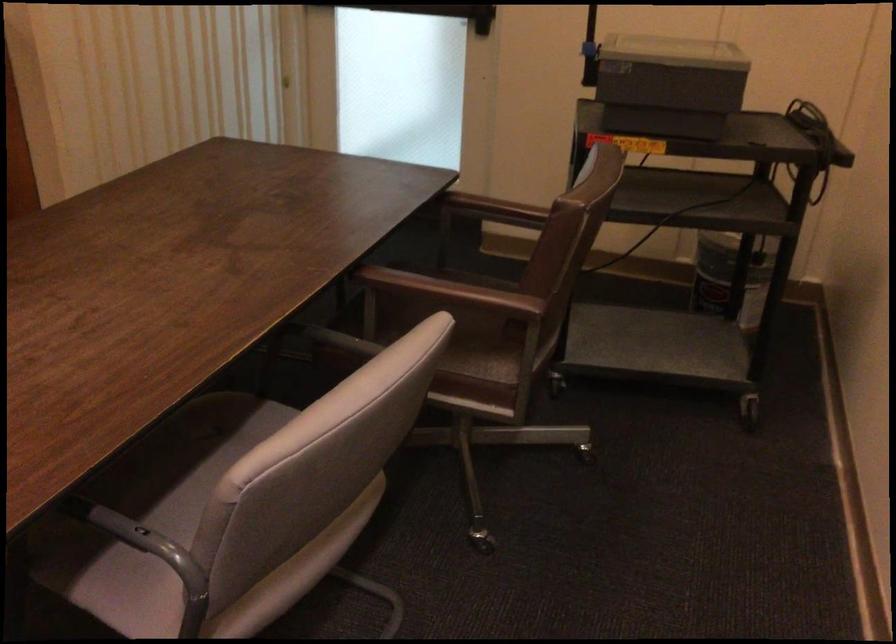
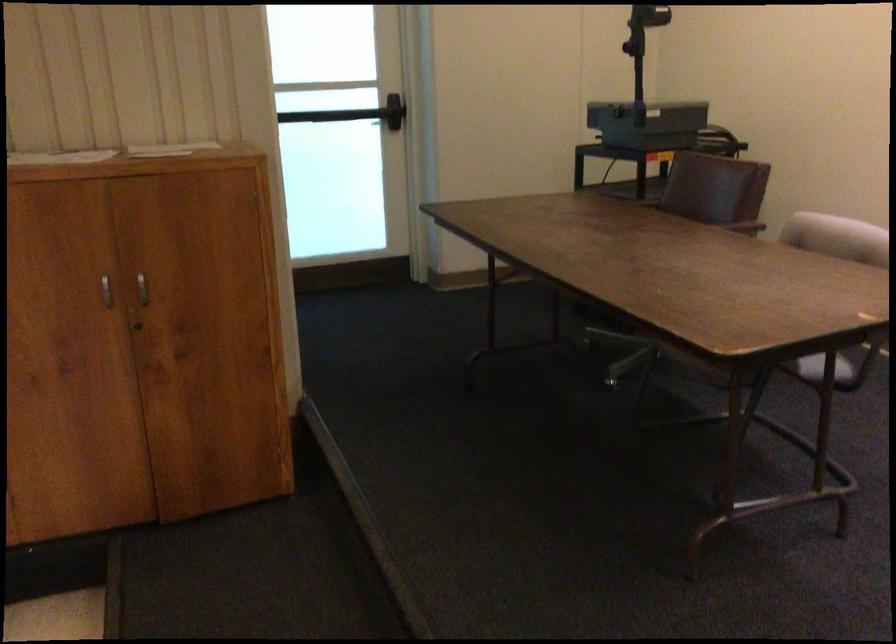
In the second image, find the point that corresponds to the point at 515,301 in the first image.

(739, 223)